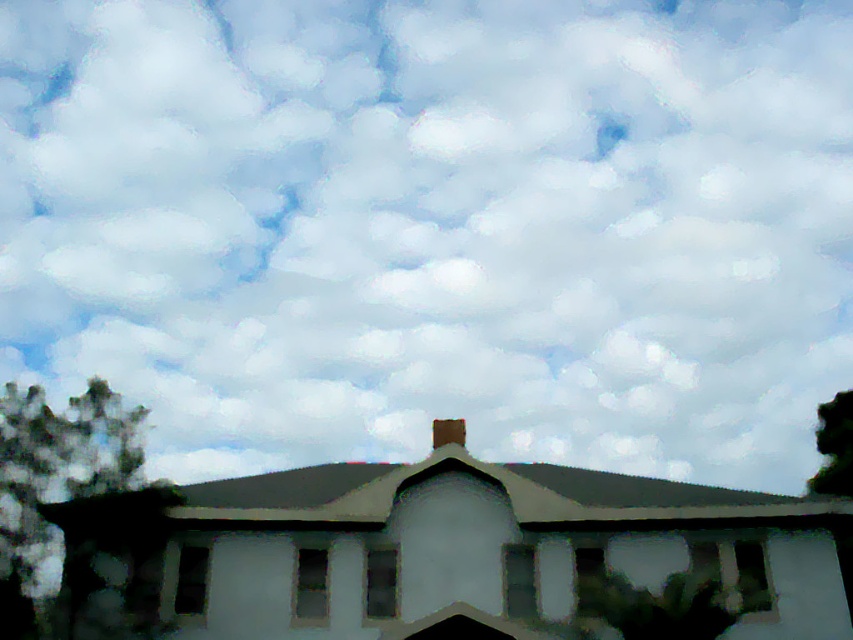
You are a bird looking for a place to perch. You can choose between the green leafy tree at lower left and the brown clay chimney at center. Which option would provide a larger surface area for you to land on?

The green leafy tree at lower left has a larger size compared to the brown clay chimney at center, so it would provide a larger surface area for you to land on.

You are a landscape architect designing a garden around the residential building. You need to place a new bench between the green leafy tree at lower left and the green matte tree at lower right. Which tree should the bench be closer to if you want it to be near the smaller tree?

The bench should be closer to the green matte tree at lower right because it is smaller than the green leafy tree at lower left.